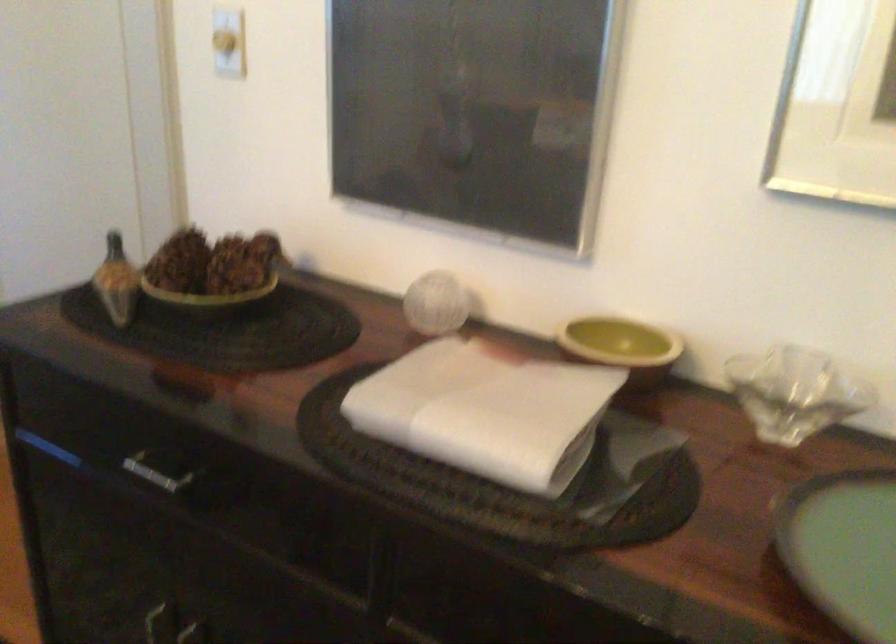
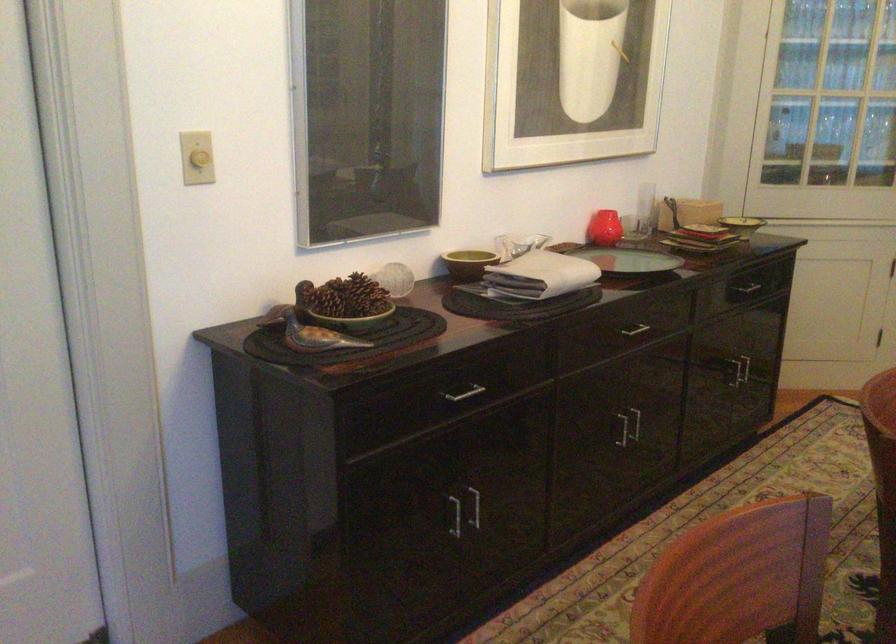
In the second image, find the point that corresponds to (x=218, y=494) in the first image.

(462, 393)